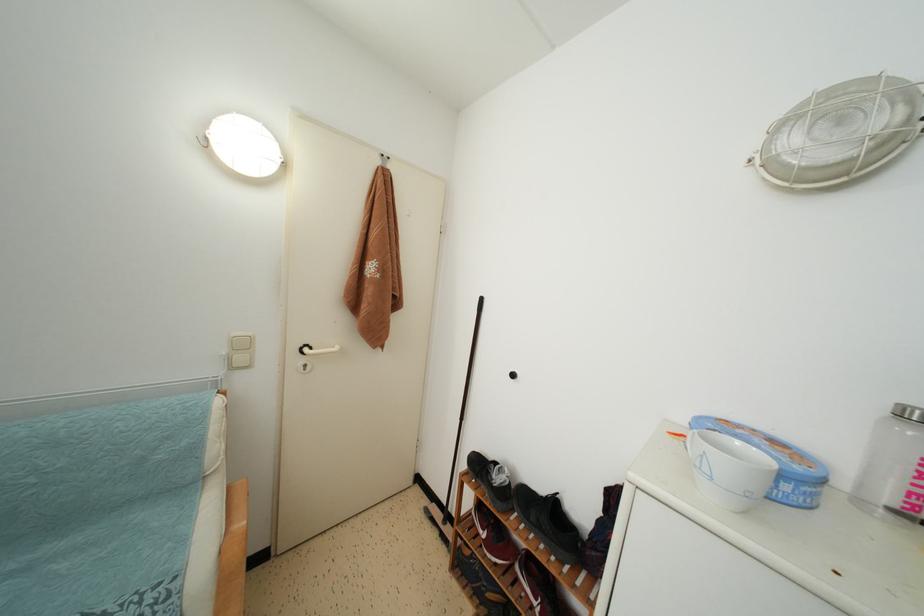
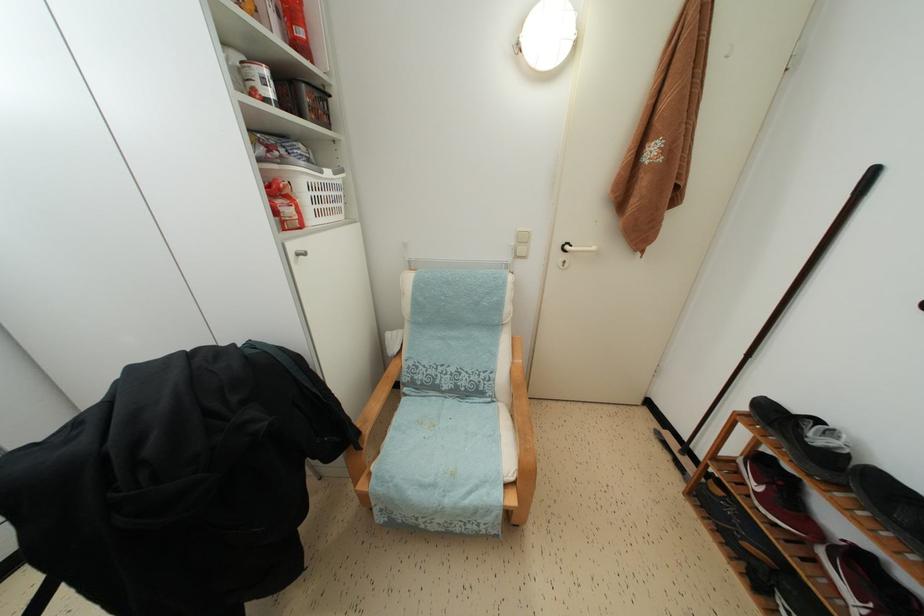
In the second image, find the point that corresponds to (x=310, y=355) in the first image.

(572, 253)